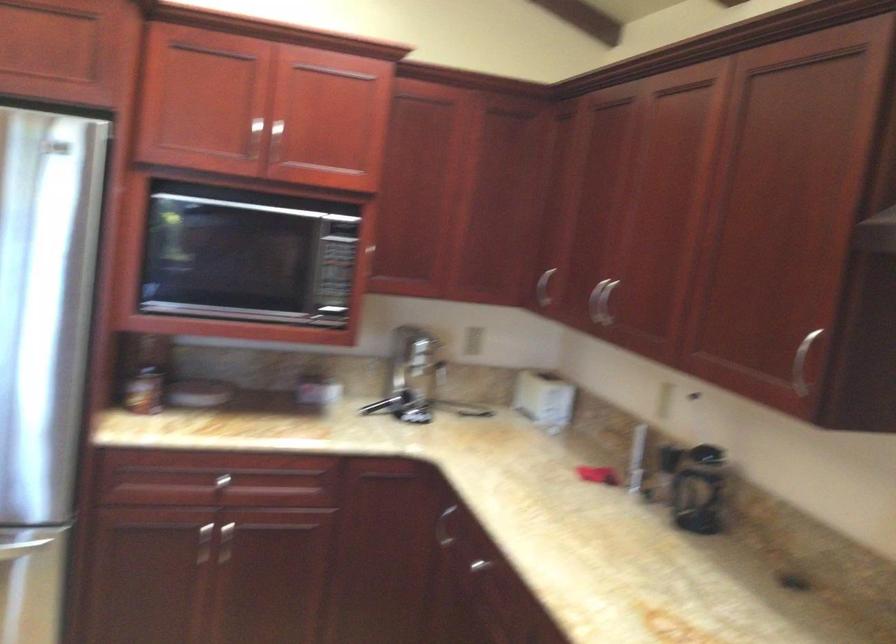
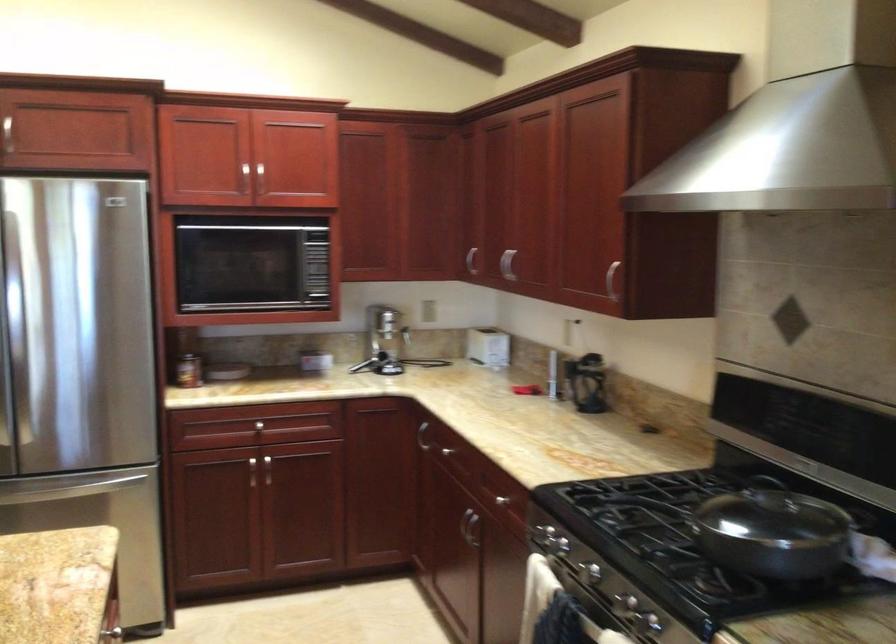
Find the pixel in the second image that matches pixel 362 343 in the first image.

(340, 322)